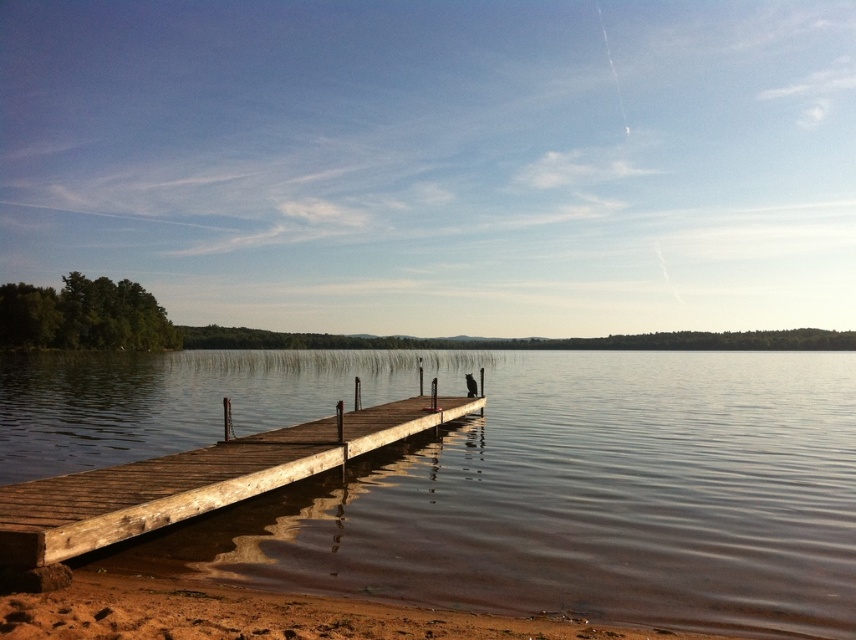
Question: Which of the following is the farthest from the observer?

Choices:
 (A) [141, 500]
 (B) [581, 627]

Answer: (A)

Question: Based on their relative distances, which object is nearer to the wooden dock at center?

Choices:
 (A) brown wooden water at center
 (B) brown sandy beach at lower left

Answer: (B)

Question: From the image, what is the correct spatial relationship of brown wooden water at center in relation to brown sandy beach at lower left?

Choices:
 (A) left
 (B) right

Answer: (A)

Question: Which object appears farthest from the camera in this image?

Choices:
 (A) wooden dock at center
 (B) brown wooden water at center

Answer: (B)

Question: Is brown wooden water at center to the left of brown sandy beach at lower left from the viewer's perspective?

Choices:
 (A) no
 (B) yes

Answer: (B)

Question: Is wooden dock at center smaller than brown sandy beach at lower left?

Choices:
 (A) yes
 (B) no

Answer: (B)